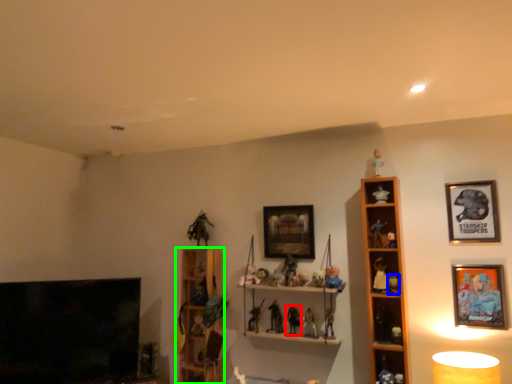
Question: Which object is the farthest from toy (highlighted by a red box)? Choose among these: toy (highlighted by a blue box) or shelf (highlighted by a green box).

Choices:
 (A) toy
 (B) shelf

Answer: (B)